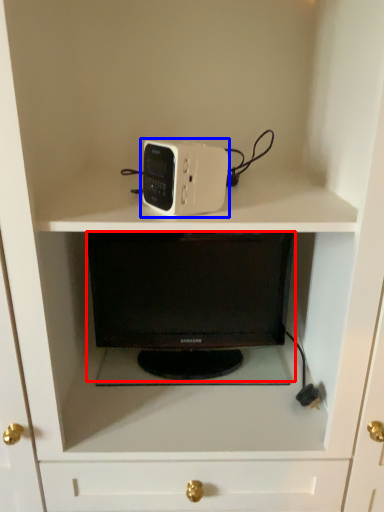
Question: Which object appears farthest to the camera in this image, desktop (highlighted by a red box) or home appliance (highlighted by a blue box)?

Choices:
 (A) desktop
 (B) home appliance

Answer: (A)